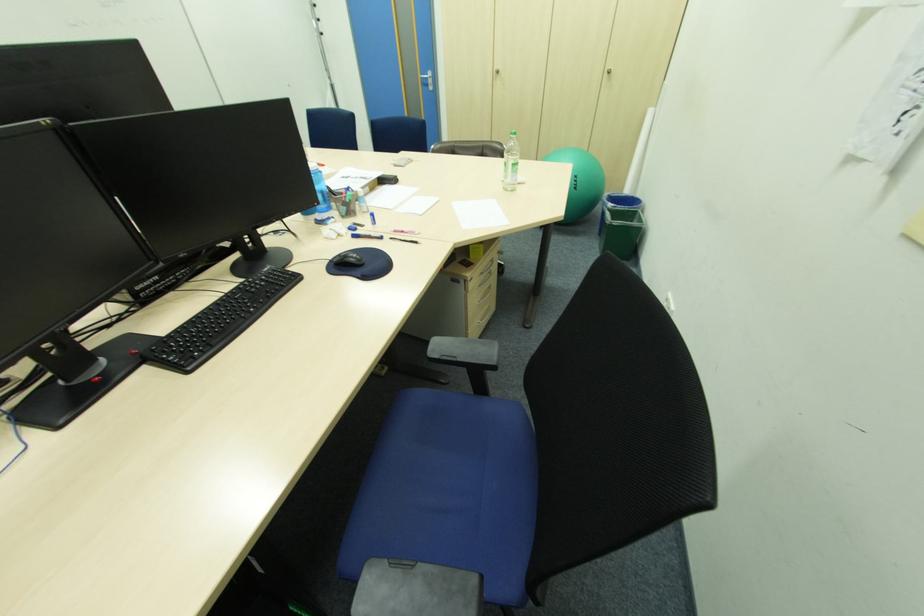
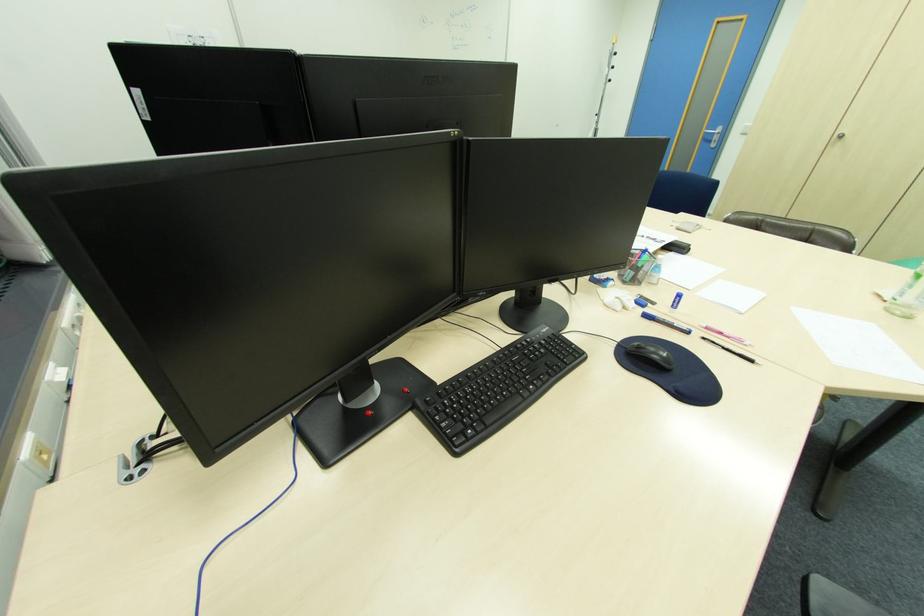
In the second image, find the point that corresponds to (396,238) in the first image.

(709, 339)